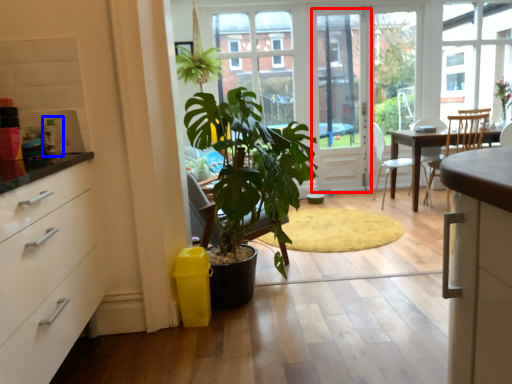
Question: Among these objects, which one is nearest to the camera, screen door (highlighted by a red box) or appliance (highlighted by a blue box)?

Choices:
 (A) screen door
 (B) appliance

Answer: (B)